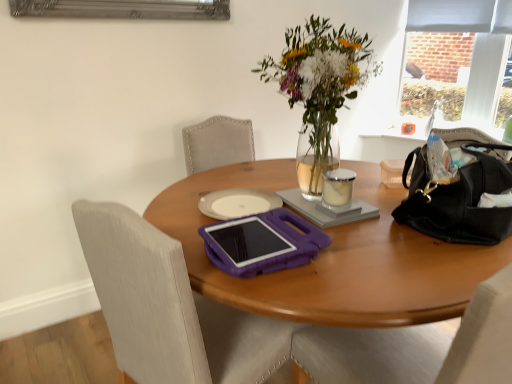
This screenshot has width=512, height=384. Describe the element at coordinates (320, 83) in the screenshot. I see `translucent glass vase at upper center` at that location.

What is the approximate height of translucent glass vase at upper center?

translucent glass vase at upper center is 22.21 inches in height.

I want to click on purple plastic tablet at center, so click(262, 243).

At what (x,y) coordinates should I click in order to perform the action: click on black leather handbag at right. Please return your answer as a coordinate pair (x, y). This screenshot has width=512, height=384. Looking at the image, I should click on (459, 192).

You are a GUI agent. You are given a task and a screenshot of the screen. Output one action in this format:
    pyautogui.click(x=<x>, y=<y>)
    Task: Click on the translucent glass vase at upper center
    Image resolution: width=512 pixels, height=384 pixels.
    Given the screenshot: What is the action you would take?
    pyautogui.click(x=320, y=83)

Considering the sizes of objects gray matte notebook at center and black leather handbag at right in the image provided, who is thinner, gray matte notebook at center or black leather handbag at right?

gray matte notebook at center is thinner.

Is gray matte notebook at center to the right of black leather handbag at right from the viewer's perspective?

No.

Is gray matte notebook at center shorter than black leather handbag at right?

Yes, gray matte notebook at center is shorter than black leather handbag at right.

Measure the distance between translucent glass vase at upper center and gray matte notebook at center.

translucent glass vase at upper center and gray matte notebook at center are 10.73 inches apart.

From the image's perspective, would you say translucent glass vase at upper center is positioned over gray matte notebook at center?

Yes, from the image's perspective, translucent glass vase at upper center is over gray matte notebook at center.

Is gray matte notebook at center completely or partially inside translucent glass vase at upper center?

No, gray matte notebook at center is located outside of translucent glass vase at upper center.

From a real-world perspective, is translucent glass vase at upper center positioned above or below gray matte notebook at center?

translucent glass vase at upper center is situated higher than gray matte notebook at center in the real world.

Who is smaller, purple plastic chair at center or matte gray curtain at upper right?

matte gray curtain at upper right.

Is purple plastic chair at center turned away from matte gray curtain at upper right?

purple plastic chair at center is not turned away from matte gray curtain at upper right.

From a real-world perspective, is purple plastic chair at center positioned over matte gray curtain at upper right based on gravity?

No, from a real-world perspective, purple plastic chair at center is not on top of matte gray curtain at upper right.

Looking at this image, can you tell me how much purple plastic chair at center and matte gray curtain at upper right differ in facing direction?

There is a 171-degree angle between the facing directions of purple plastic chair at center and matte gray curtain at upper right.

Which of these two, black leather bag at right or purple plastic tablet at center, is wider?

With larger width is black leather bag at right.

Based on the photo, considering the sizes of objects black leather bag at right and purple plastic tablet at center in the image provided, who is smaller, black leather bag at right or purple plastic tablet at center?

purple plastic tablet at center is smaller.

Is black leather bag at right located outside purple plastic tablet at center?

Indeed, black leather bag at right is completely outside purple plastic tablet at center.

Can you confirm if black leather bag at right is taller than purple plastic tablet at center?

Yes, black leather bag at right is taller than purple plastic tablet at center.

Is black leather handbag at right spatially inside matte gray curtain at upper right, or outside of it?

black leather handbag at right is spatially situated outside matte gray curtain at upper right.

Between black leather handbag at right and matte gray curtain at upper right, which one has smaller width?

Thinner between the two is matte gray curtain at upper right.

Is point (469, 232) in front of point (440, 26)?

Yes, point (469, 232) is in front of point (440, 26).

Is black leather handbag at right next to matte gray curtain at upper right?

No, black leather handbag at right is not in contact with matte gray curtain at upper right.

From a real-world perspective, is white matte notepad at center beneath black leather bag at right?

No, from a real-world perspective, white matte notepad at center is not beneath black leather bag at right.

Is the depth of white matte notepad at center greater than that of black leather bag at right?

Yes.

From the image's perspective, does white matte notepad at center appear higher than black leather bag at right?

Correct, white matte notepad at center appears higher than black leather bag at right in the image.

Is black leather bag at right far from matte gray curtain at upper right?

black leather bag at right is positioned a significant distance from matte gray curtain at upper right.

Which object is more forward, black leather bag at right or matte gray curtain at upper right?

black leather bag at right is in front.

Is black leather bag at right bigger or smaller than matte gray curtain at upper right?

black leather bag at right is bigger than matte gray curtain at upper right.

What's the angular difference between black leather bag at right and matte gray curtain at upper right's facing directions?

The angular difference between black leather bag at right and matte gray curtain at upper right is 120 degrees.

At what (x,y) coordinates should I click in order to perform the action: click on handbag on the right of gray matte notebook at center. Please return your answer as a coordinate pair (x, y). Looking at the image, I should click on (459, 192).

Find the location of `flower above the gray matte notebook at center (from a real-world perspective)`. flower above the gray matte notebook at center (from a real-world perspective) is located at coordinates (320, 83).

Consider the image. From the image, which object appears to be nearer to purple plastic chair at center, clear glass candle at center or purple plastic tablet at center?

purple plastic tablet at center lies closer to purple plastic chair at center than the other object.

Which object lies further to the anchor point clear glass candle at center, matte gray curtain at upper right or black leather handbag at right?

matte gray curtain at upper right is positioned further to the anchor clear glass candle at center.

Looking at this image, from the image, which object appears to be farther from clear glass candle at center, matte gray curtain at upper right or gray matte notebook at center?

The object further to clear glass candle at center is matte gray curtain at upper right.

Which object lies nearer to the anchor point purple plastic tablet at center, black leather bag at right or clear glass candle at center?

black leather bag at right.

From the image, which object appears to be nearer to gray matte notebook at center, clear glass candle at center or translucent glass vase at upper center?

The object closer to gray matte notebook at center is clear glass candle at center.

Which object lies nearer to the anchor point translucent glass vase at upper center, purple plastic chair at center or clear glass candle at center?

clear glass candle at center lies closer to translucent glass vase at upper center than the other object.

Based on their spatial positions, is translucent glass vase at upper center or gray matte notebook at center closer to purple plastic tablet at center?

Among the two, gray matte notebook at center is located nearer to purple plastic tablet at center.

Considering their positions, is white matte notepad at center positioned further to purple plastic tablet at center than black leather handbag at right?

The object further to purple plastic tablet at center is black leather handbag at right.

Locate an element on the screen. notepad located between translucent glass vase at upper center and black leather handbag at right in the left-right direction is located at coordinates (339, 210).

You are a GUI agent. You are given a task and a screenshot of the screen. Output one action in this format:
    pyautogui.click(x=<x>, y=<y>)
    Task: Click on the notebook positioned between purple plastic tablet at center and clear glass candle at center from near to far
    The height and width of the screenshot is (384, 512).
    Given the screenshot: What is the action you would take?
    pyautogui.click(x=327, y=210)

At what (x,y) coordinates should I click in order to perform the action: click on notebook between translucent glass vase at upper center and purple plastic chair at center in the up-down direction. Please return your answer as a coordinate pair (x, y). This screenshot has height=384, width=512. Looking at the image, I should click on (327, 210).

Identify the location of coffee cup between translucent glass vase at upper center and black leather bag at right from top to bottom. [337, 188].